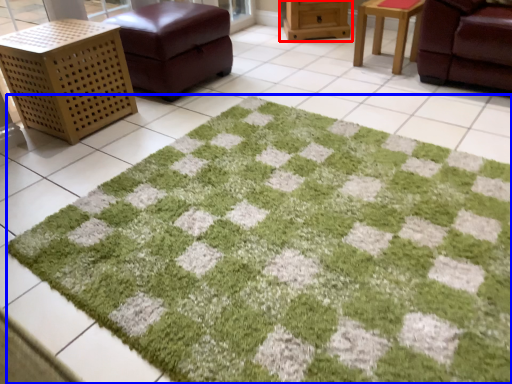
Question: Which point is further to the camera, furniture (highlighted by a red box) or bath mat (highlighted by a blue box)?

Choices:
 (A) furniture
 (B) bath mat

Answer: (A)